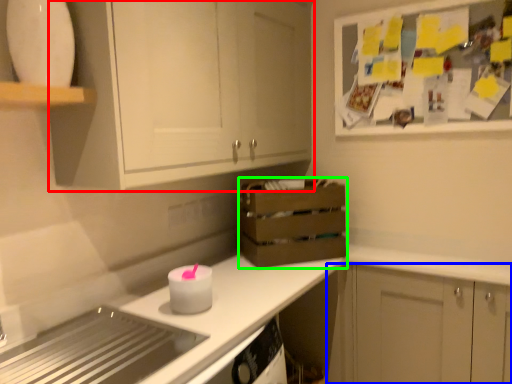
Question: Which object is the closest to the cabinetry (highlighted by a red box)? Choose among these: cabinetry (highlighted by a blue box) or crate (highlighted by a green box).

Choices:
 (A) cabinetry
 (B) crate

Answer: (B)